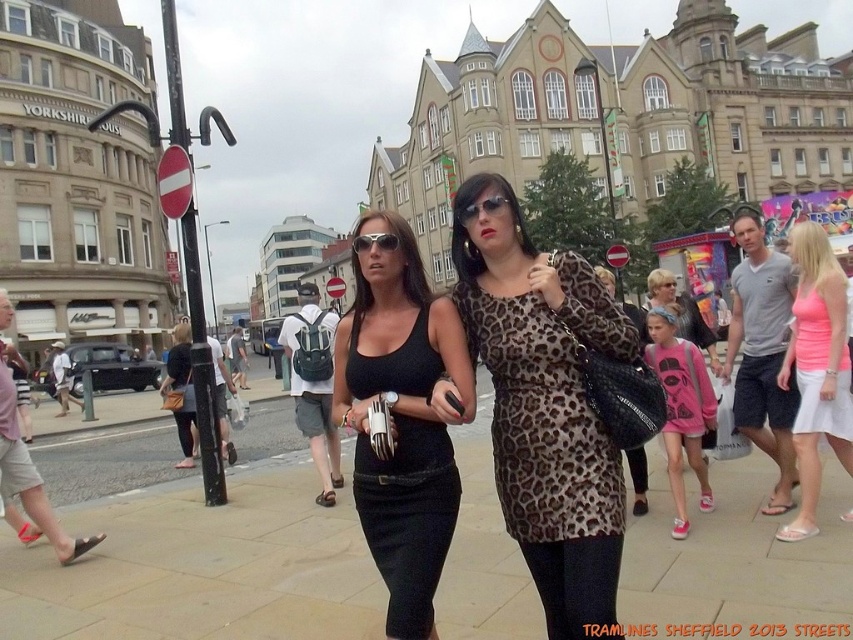
Question: Where is black matte dress at center located in relation to pink matte tank top at center in the image?

Choices:
 (A) right
 (B) left

Answer: (B)

Question: Among these objects, which one is nearest to the camera?

Choices:
 (A) smooth concrete sidewalk at center
 (B) black matte dress at center
 (C) pink cotton dress at center
 (D) matte black sunglasses at center

Answer: (A)

Question: In this image, where is black matte dress at center located relative to pink matte tank top at center?

Choices:
 (A) right
 (B) left

Answer: (B)

Question: Which object appears closest to the camera in this image?

Choices:
 (A) pink satin dress at center
 (B) leopard print dress at center
 (C) pink matte tank top at center

Answer: (B)

Question: Estimate the real-world distances between objects in this image. Which object is farther from the pink satin dress at center?

Choices:
 (A) pink matte tank top at center
 (B) black matte dress at center
 (C) matte black sunglasses at center

Answer: (B)

Question: Is pink cotton dress at center to the left of pink satin dress at center from the viewer's perspective?

Choices:
 (A) yes
 (B) no

Answer: (A)